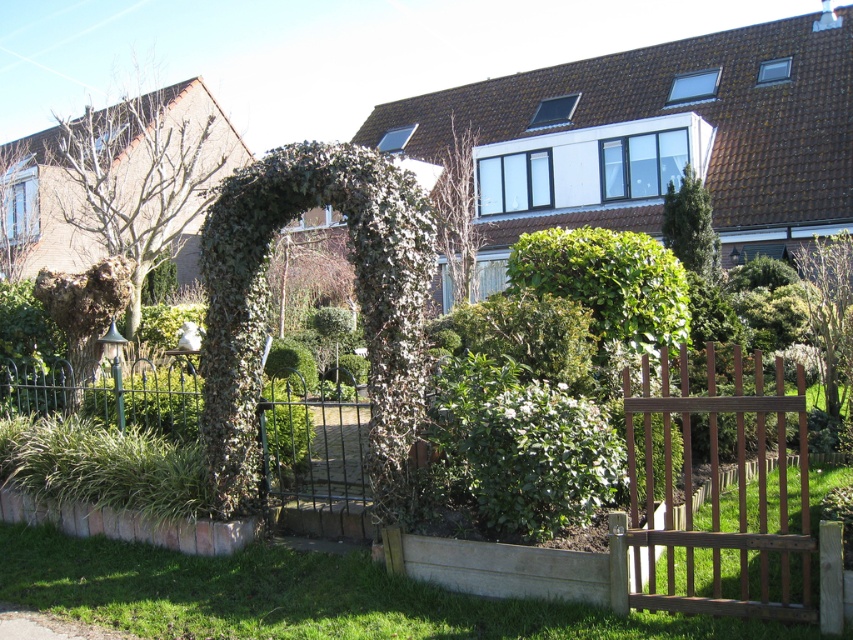
Question: Which point is farther to the camera?

Choices:
 (A) (363, 164)
 (B) (705, 611)

Answer: (A)

Question: Is green ivy-covered arch at center further to camera compared to green leafy tree at upper right?

Choices:
 (A) no
 (B) yes

Answer: (A)

Question: Which point is closer to the camera?

Choices:
 (A) green leafy bush at center
 (B) green ivy-covered arch at center
 (C) green leafy tree at right
 (D) green leafy tree at upper left

Answer: (A)

Question: Does green ivy-covered arch at center have a lesser width compared to bare branches at left?

Choices:
 (A) yes
 (B) no

Answer: (A)

Question: Does green leafy bush at center appear under brown wooden gate at lower right?

Choices:
 (A) yes
 (B) no

Answer: (B)

Question: Which object is closer to the camera taking this photo?

Choices:
 (A) green leafy tree at right
 (B) green leafy bush at center
 (C) green leafy tree at upper right

Answer: (B)